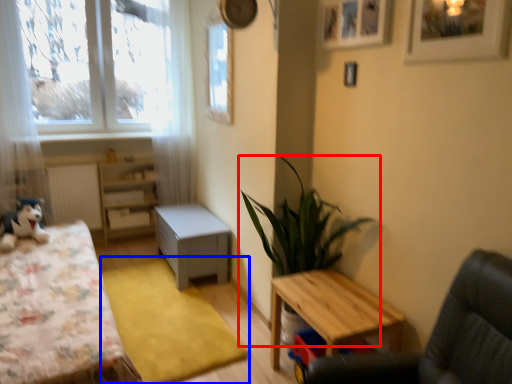
Question: Which of the following is the farthest to the observer, houseplant (highlighted by a red box) or mat (highlighted by a blue box)?

Choices:
 (A) houseplant
 (B) mat

Answer: (B)